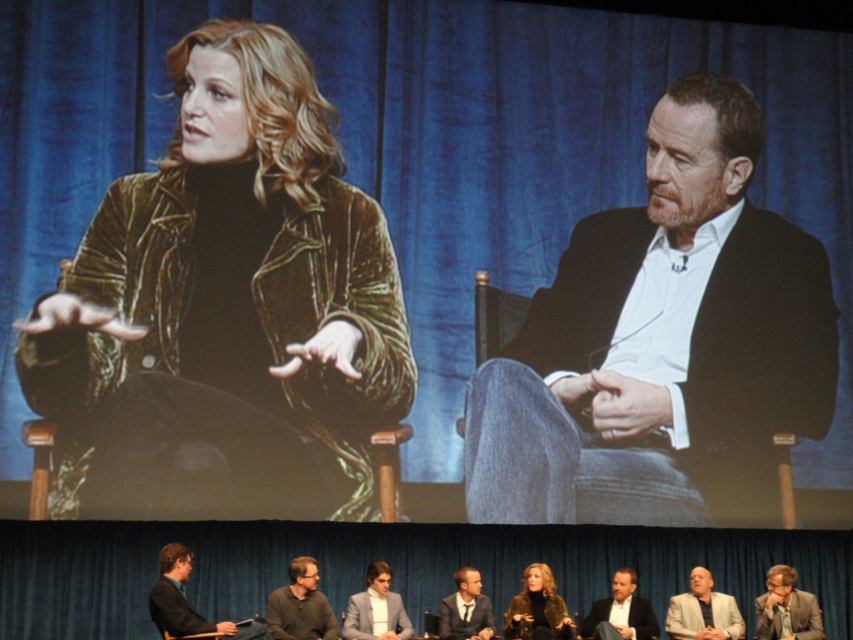
You are an event organizer who needs to adjust the seating arrangement for the panel discussion. The current setup has the matte black jacket at right and the gray suit at center. Since you want to ensure that the person in the wider jacket has more space, which jacket should you prioritize moving to a wider seat?

The matte black jacket at right is wider than the gray suit at center, so you should prioritize moving the matte black jacket at right to a wider seat.

Looking at this image, you are an event organizer who needs to ensure that all seating arrangements accommodate the attendees. Given that the dark gray suit at lower left and the gray suit at center are part of the front row seating, which suit takes up more space in the row?

The dark gray suit at lower left takes up more space in the row because its width is larger than the gray suit at center.

You are a stagehand responsible for arranging chairs for the next panel. You need to place a chair between the matte black jacket at right and the matte gray suit at lower right. Based on their positions, which side of the chair should face forward to align with the existing seating arrangement?

The existing seating arrangement has the matte black jacket at right and matte gray suit at lower right facing forward. Therefore, the new chair should also face forward to maintain alignment with the existing seating.